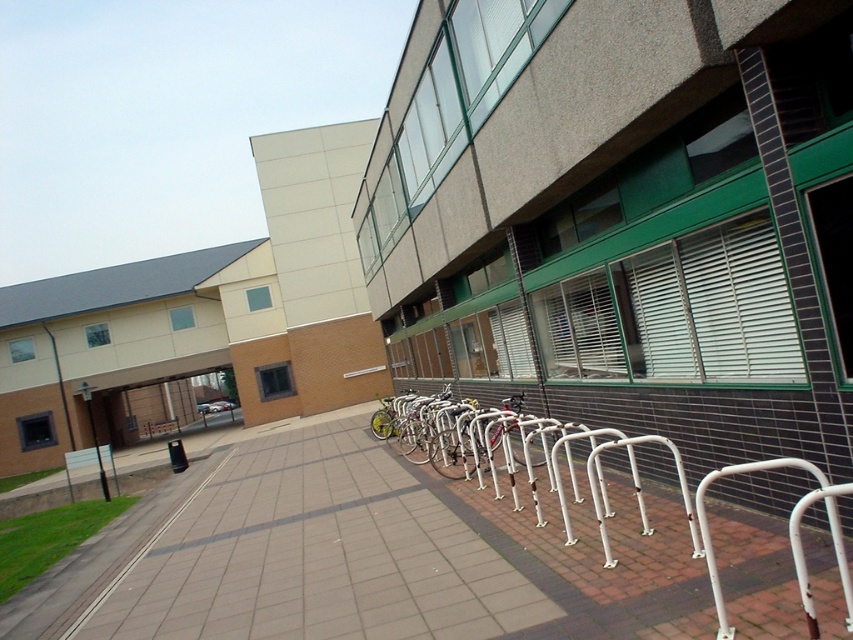
Between white metal bike rack at lower center and silver metallic bicycle at center, which one appears on the left side from the viewer's perspective?

From the viewer's perspective, silver metallic bicycle at center appears more on the left side.

Is white metal bike rack at lower center thinner than silver metallic bicycle at center?

Indeed, white metal bike rack at lower center has a lesser width compared to silver metallic bicycle at center.

What are the coordinates of `white metal bike rack at lower center` in the screenshot? It's located at (605, 515).

Does smooth concrete sidewalk at lower left appear on the left side of silver metallic bicycle at center?

Indeed, smooth concrete sidewalk at lower left is positioned on the left side of silver metallic bicycle at center.

Is smooth concrete sidewalk at lower left behind silver metallic bicycle at center?

No.

Between point (192, 492) and point (384, 433), which one is positioned in front?

Point (192, 492)

Identify the location of smooth concrete sidewalk at lower left. (137, 556).

Can you confirm if white metal bike rack at lower center is taller than smooth concrete sidewalk at lower left?

Incorrect, white metal bike rack at lower center's height is not larger of smooth concrete sidewalk at lower left's.

How much distance is there between white metal bike rack at lower center and smooth concrete sidewalk at lower left?

They are 7.05 meters apart.

Does point (601, 596) lie in front of point (165, 524)?

Yes, point (601, 596) is in front of point (165, 524).

Identify the location of white metal bike rack at lower center. (605, 515).